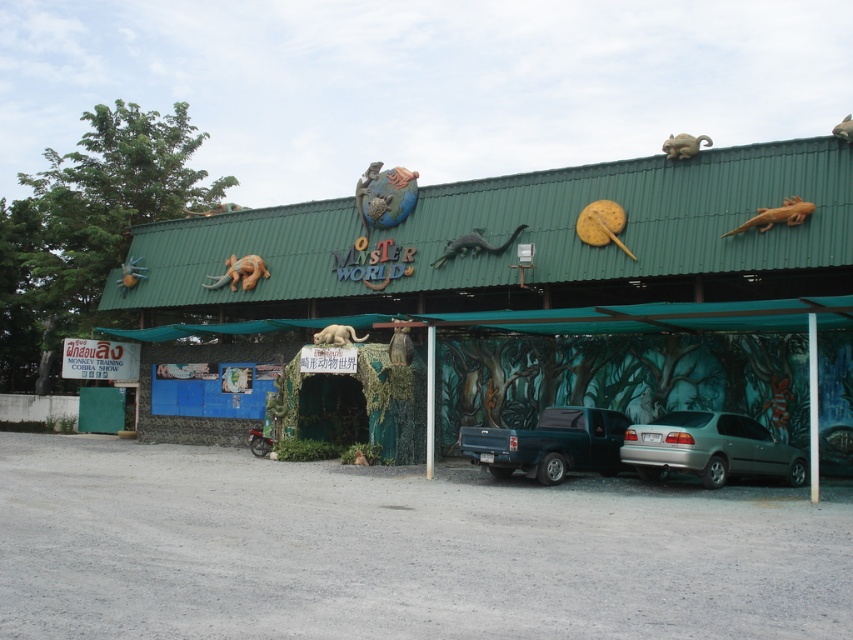
You are standing in front of the Monster World building and want to take a photo. You notice two points marked on the building facade at coordinates point (456,292) and point (318,332). Which point is closer to your camera when taking the photo?

Point (318,332) is closer to the camera because it is not as far as point (456,292), which is further away.

You are a visitor arriving at the Monster World building and need to park your car. You see the silver metallic sedan at lower right and the smooth gray shark at upper right. Which object is closer to you as you approach the building?

The silver metallic sedan at lower right is closer to you than the smooth gray shark at upper right.